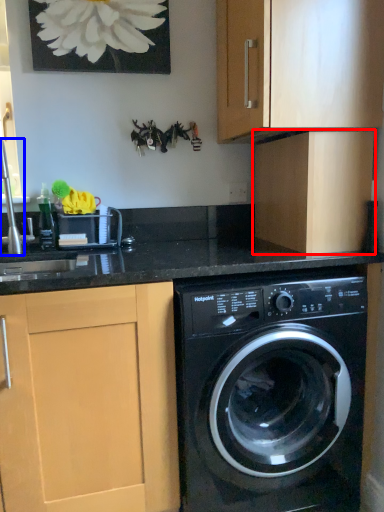
Question: Which object is closer to the camera taking this photo, cabinetry (highlighted by a red box) or faucet (highlighted by a blue box)?

Choices:
 (A) cabinetry
 (B) faucet

Answer: (B)